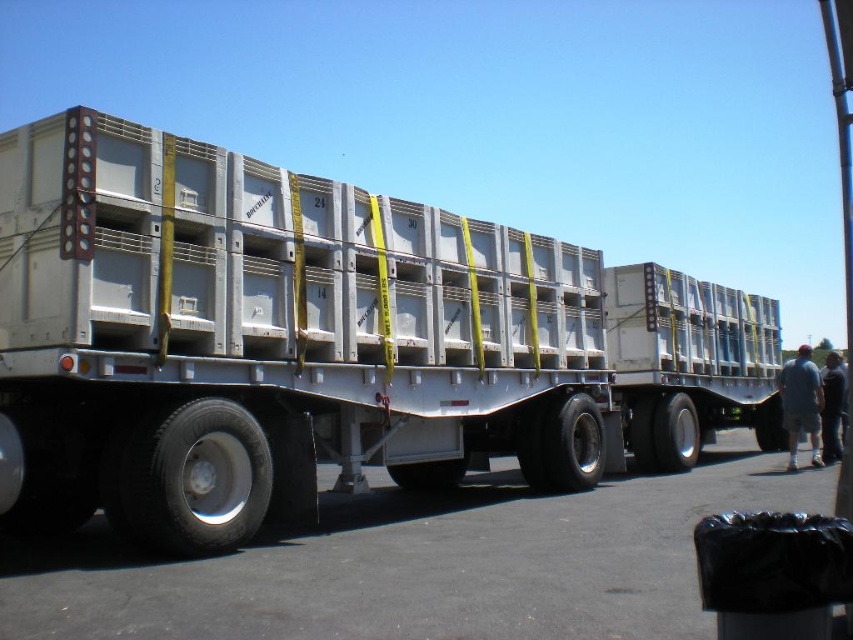
Question: Which point appears farthest from the camera in this image?

Choices:
 (A) (798, 442)
 (B) (7, 324)

Answer: (A)

Question: Does metallic gray trailer truck at center have a larger size compared to gray cotton shorts at lower right?

Choices:
 (A) yes
 (B) no

Answer: (B)

Question: Can you confirm if metallic gray trailer truck at center is thinner than gray cotton shorts at lower right?

Choices:
 (A) no
 (B) yes

Answer: (B)

Question: Which point is farther to the camera?

Choices:
 (A) (819, 380)
 (B) (433, 348)

Answer: (A)

Question: In this image, where is metallic gray trailer truck at center located relative to gray cotton shorts at lower right?

Choices:
 (A) below
 (B) above

Answer: (B)